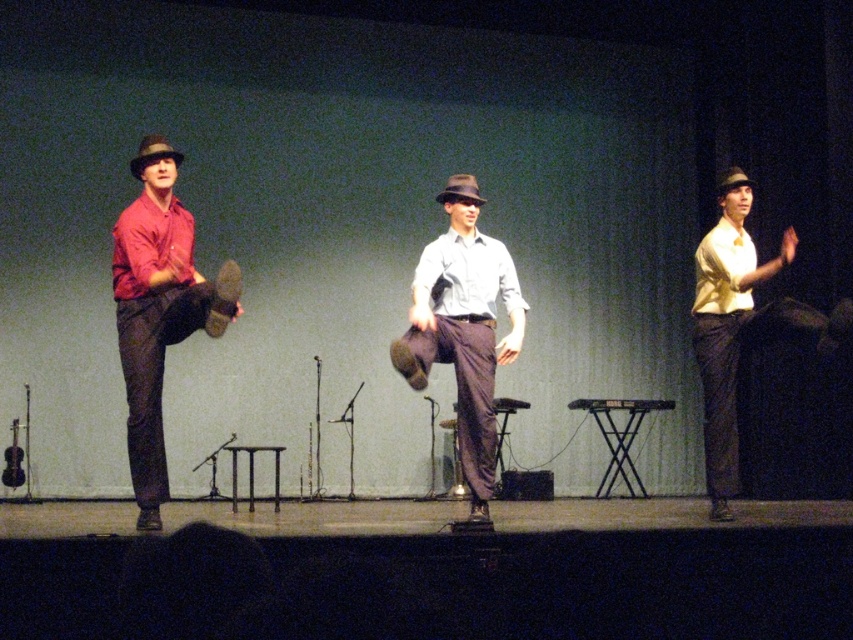
Question: Does matte red shirt at left appear on the left side of matte yellow shirt at right?

Choices:
 (A) yes
 (B) no

Answer: (A)

Question: Which of these objects is positioned closest to the matte red shirt at left?

Choices:
 (A) matte brown fedora at center
 (B) matte yellow shirt at right
 (C) matte gray shirt at center

Answer: (C)

Question: Can you confirm if matte gray shirt at center is positioned below matte yellow shirt at right?

Choices:
 (A) yes
 (B) no

Answer: (A)

Question: Which of these objects is positioned farthest from the matte red shirt at left?

Choices:
 (A) matte brown fedora at center
 (B) matte yellow shirt at right

Answer: (B)

Question: Which point is farther to the camera?

Choices:
 (A) matte brown fedora at center
 (B) matte gray shirt at center
 (C) matte red shirt at left

Answer: (A)

Question: Does matte gray shirt at center have a larger size compared to matte brown fedora at center?

Choices:
 (A) yes
 (B) no

Answer: (A)